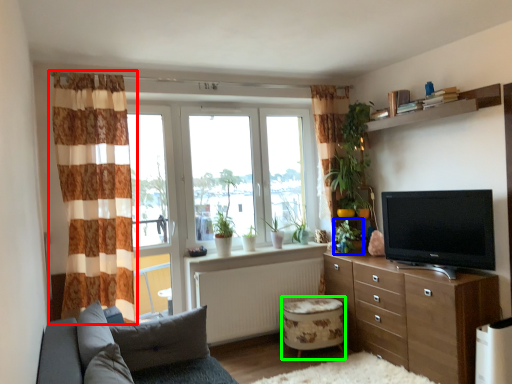
Question: Which object is positioned closest to curtain (highlighted by a red box)? Select from plant (highlighted by a blue box) and stool (highlighted by a green box).

Choices:
 (A) plant
 (B) stool

Answer: (B)